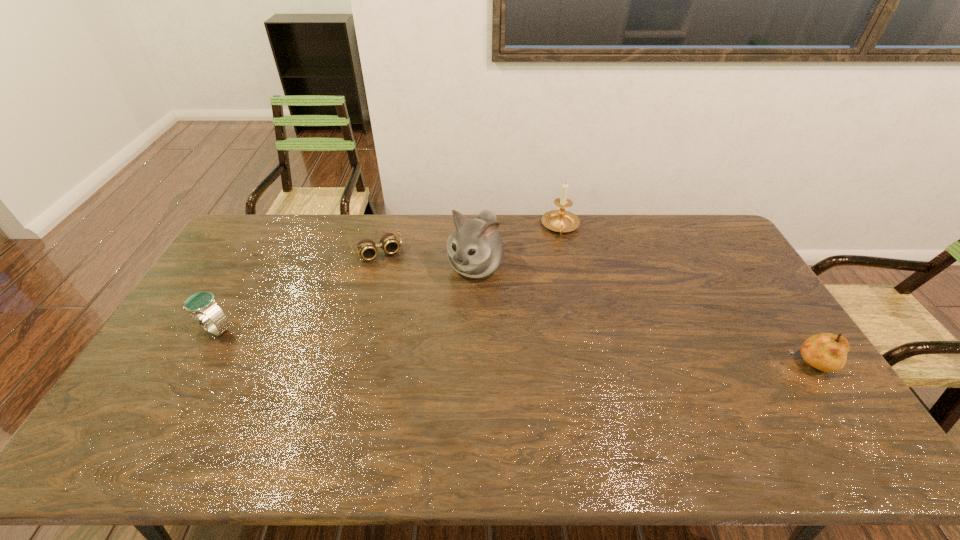
Locate an element on the screen. The width and height of the screenshot is (960, 540). the leftmost object is located at coordinates (202, 307).

You are a GUI agent. You are given a task and a screenshot of the screen. Output one action in this format:
    pyautogui.click(x=<x>, y=<y>)
    Task: Click on the second nearest object
    The width and height of the screenshot is (960, 540).
    Given the screenshot: What is the action you would take?
    pyautogui.click(x=202, y=307)

The width and height of the screenshot is (960, 540). I want to click on the nearest object, so click(827, 352).

Locate an element on the screen. the rightmost object is located at coordinates (827, 352).

Where is `the third object from left to right`? The image size is (960, 540). the third object from left to right is located at coordinates (475, 249).

Locate an element on the screen. Image resolution: width=960 pixels, height=540 pixels. the tallest object is located at coordinates (475, 249).

In order to click on goggles in this screenshot , I will do `click(367, 249)`.

Where is `the shortest object`? The image size is (960, 540). the shortest object is located at coordinates (367, 249).

Identify the location of the fourth object from left to right. This screenshot has width=960, height=540. (561, 220).

Locate an element on the screen. This screenshot has height=540, width=960. candle holder is located at coordinates (561, 220).